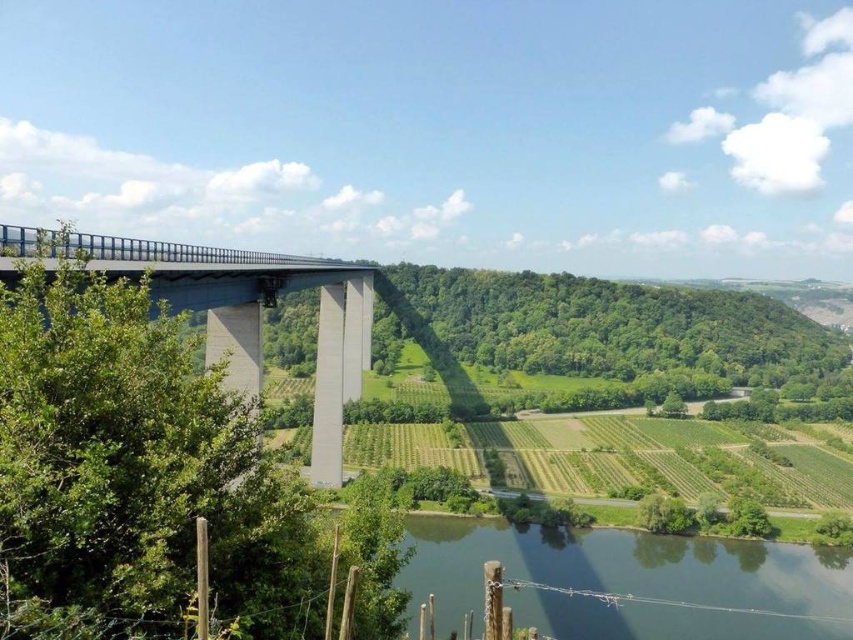
Question: Does green smooth water at lower center appear on the left side of concrete bridge at left?

Choices:
 (A) no
 (B) yes

Answer: (A)

Question: Which point is closer to the camera?

Choices:
 (A) concrete bridge at left
 (B) green smooth water at lower center

Answer: (A)

Question: Is the position of green smooth water at lower center more distant than that of concrete bridge at left?

Choices:
 (A) yes
 (B) no

Answer: (A)

Question: Which point is farther to the camera?

Choices:
 (A) green smooth water at lower center
 (B) concrete bridge at left

Answer: (A)

Question: Does green smooth water at lower center come in front of concrete bridge at left?

Choices:
 (A) yes
 (B) no

Answer: (B)